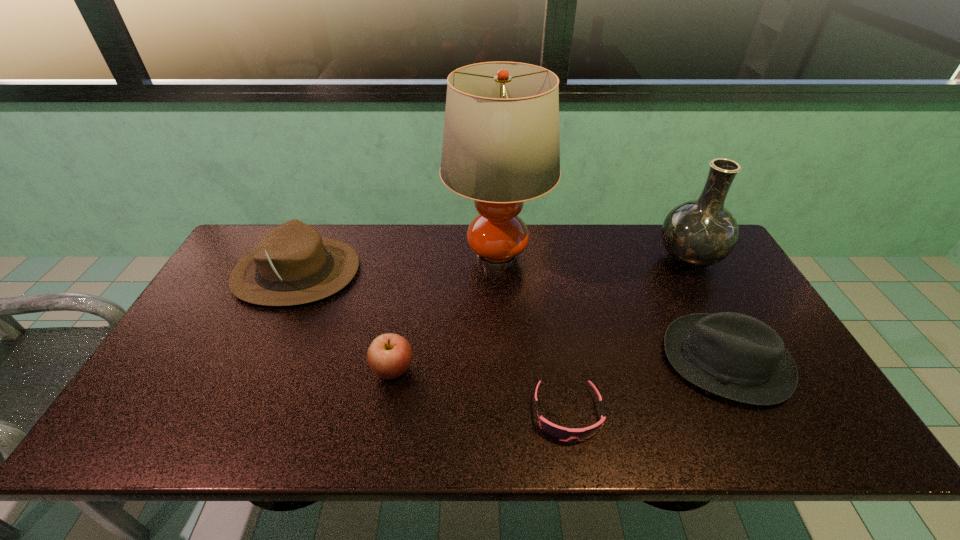
In order to click on object at the far left corner in this screenshot , I will do `click(292, 265)`.

Find the location of a particular element. object located at the far right corner is located at coordinates (699, 233).

This screenshot has height=540, width=960. Find the location of `vacant space at the far edge of the desktop`. vacant space at the far edge of the desktop is located at coordinates (456, 264).

Identify the location of free space at the near edge of the desktop. (394, 421).

You are a GUI agent. You are given a task and a screenshot of the screen. Output one action in this format:
    pyautogui.click(x=<x>, y=<y>)
    Task: Click on the free space at the right edge of the desktop
    The height and width of the screenshot is (540, 960).
    Given the screenshot: What is the action you would take?
    pyautogui.click(x=820, y=401)

Find the location of a particular element. The width and height of the screenshot is (960, 540). empty space that is in between the shortest object and the shorter fedora is located at coordinates (646, 386).

Where is `vacant region between the shortest object and the tallest object`? This screenshot has height=540, width=960. vacant region between the shortest object and the tallest object is located at coordinates (532, 335).

I want to click on vacant space that's between the second tallest object and the second object from left to right, so point(540,314).

Identify the location of free space between the nearer fedora and the goggles. [646, 386].

Image resolution: width=960 pixels, height=540 pixels. I want to click on free point between the vase and the fifth object from right to left, so coord(540,314).